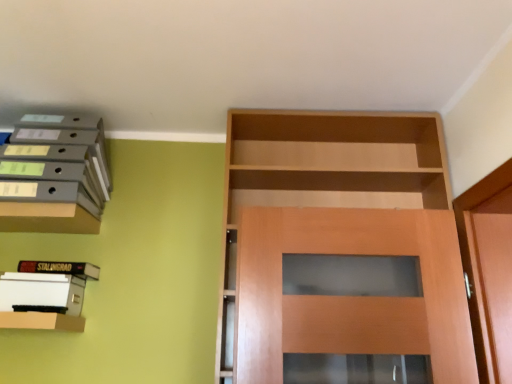
Question: Is white paper at left, which ranks as the 1th book in bottom-to-top order, to the left of matte wood shelf at upper left from the viewer's perspective?

Choices:
 (A) yes
 (B) no

Answer: (B)

Question: Is white paper at left, positioned as the 2th book in top-to-bottom order, oriented towards matte wood shelf at upper left?

Choices:
 (A) no
 (B) yes

Answer: (A)

Question: Does white paper at left, which ranks as the 1th book in bottom-to-top order, have a smaller size compared to matte wood shelf at upper left?

Choices:
 (A) yes
 (B) no

Answer: (B)

Question: Is white paper at left, which ranks as the 1th book in bottom-to-top order, not near matte wood shelf at upper left?

Choices:
 (A) no
 (B) yes

Answer: (A)

Question: Can you confirm if white paper at left, positioned as the 2th book in top-to-bottom order, is bigger than matte wood shelf at upper left?

Choices:
 (A) yes
 (B) no

Answer: (A)

Question: Is white paper at left, which ranks as the 1th book in bottom-to-top order, located outside matte wood shelf at upper left?

Choices:
 (A) yes
 (B) no

Answer: (A)

Question: Considering the relative sizes of matte gray folders at upper left, which is counted as the 1th shelf, starting from the top, and matte wood shelf at upper left in the image provided, is matte gray folders at upper left, which is counted as the 1th shelf, starting from the top, shorter than matte wood shelf at upper left?

Choices:
 (A) no
 (B) yes

Answer: (A)

Question: Could you tell me if matte gray folders at upper left, marked as the 2th shelf in a bottom-to-top arrangement, is facing matte wood shelf at upper left?

Choices:
 (A) yes
 (B) no

Answer: (B)

Question: Is matte gray folders at upper left, marked as the 2th shelf in a bottom-to-top arrangement, closer to camera compared to matte wood shelf at upper left?

Choices:
 (A) yes
 (B) no

Answer: (A)

Question: Is matte gray folders at upper left, marked as the 2th shelf in a bottom-to-top arrangement, at the left side of matte wood shelf at upper left?

Choices:
 (A) no
 (B) yes

Answer: (B)

Question: Is matte gray folders at upper left, which is counted as the 1th shelf, starting from the top, thinner than matte wood shelf at upper left?

Choices:
 (A) yes
 (B) no

Answer: (B)

Question: From a real-world perspective, is matte gray folders at upper left, marked as the 2th shelf in a bottom-to-top arrangement, on top of matte wood shelf at upper left?

Choices:
 (A) yes
 (B) no

Answer: (A)

Question: Is there a large distance between hardcover book at upper left, which appears as the 1th book when viewed from the top, and matte wood shelf at upper left?

Choices:
 (A) yes
 (B) no

Answer: (B)